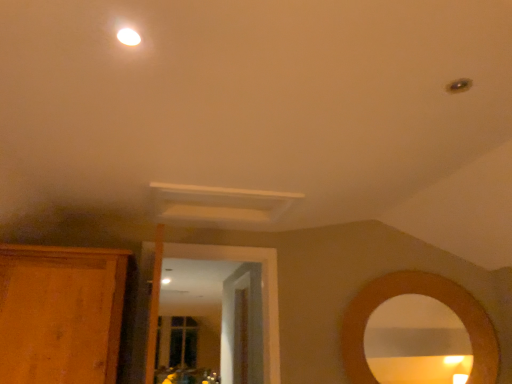
Identify the location of wooden door at center. The height and width of the screenshot is (384, 512). (242, 326).

Find the location of `wooden cabinet at left`. wooden cabinet at left is located at coordinates (61, 314).

Is white glossy light fixture at upper center to the left of wooden cabinet at left from the viewer's perspective?

No.

From the image's perspective, does white glossy light fixture at upper center appear lower than wooden cabinet at left?

No, from the image's perspective, white glossy light fixture at upper center is not below wooden cabinet at left.

In the scene shown: Is wooden door at center aimed at wooden cabinet at left?

No, wooden door at center is not oriented towards wooden cabinet at left.

Looking at this image, from their relative heights in the image, would you say wooden door at center is taller or shorter than wooden cabinet at left?

wooden door at center is taller than wooden cabinet at left.

Is wooden door at center not near wooden cabinet at left?

Yes, wooden door at center and wooden cabinet at left are located far from each other.

You are a GUI agent. You are given a task and a screenshot of the screen. Output one action in this format:
    pyautogui.click(x=<x>, y=<y>)
    Task: Click on the lighting lying on the left of wooden door at center
    Image resolution: width=512 pixels, height=384 pixels.
    Given the screenshot: What is the action you would take?
    pyautogui.click(x=128, y=37)

Looking at this image, who is taller, wooden door at center or white glossy light fixture at upper center?

wooden door at center.

How distant is wooden door at center from white glossy light fixture at upper center?

The distance of wooden door at center from white glossy light fixture at upper center is 3.34 meters.

Is wooden door at center positioned before white glossy light fixture at upper center?

No, wooden door at center is further to the viewer.

Is wooden cabinet at left inside or outside of wooden door at center?

The correct answer is: outside.

Is wooden cabinet at left to the left or to the right of wooden door at center in the image?

Based on their positions, wooden cabinet at left is located to the left of wooden door at center.

In the scene shown: Is wooden cabinet at left wider or thinner than wooden door at center?

In the image, wooden cabinet at left appears to be wider than wooden door at center.

From a real-world perspective, which object rests below the other?

In real-world perspective, wooden door at center is lower.

At what (x,y) coordinates should I click in order to perform the action: click on cabinetry on the left of the white glossy light fixture at upper center. Please return your answer as a coordinate pair (x, y). The image size is (512, 384). Looking at the image, I should click on (61, 314).

How far apart are wooden cabinet at left and white glossy light fixture at upper center?

wooden cabinet at left and white glossy light fixture at upper center are 1.48 meters apart.

From the image's perspective, between wooden cabinet at left and white glossy light fixture at upper center, who is located below?

From the image's view, wooden cabinet at left is below.

Between wooden cabinet at left and white glossy light fixture at upper center, which one has less height?

Standing shorter between the two is white glossy light fixture at upper center.

From the image's perspective, is white glossy light fixture at upper center above or below wooden door at center?

white glossy light fixture at upper center is situated higher than wooden door at center in the image.

Can you tell me how much white glossy light fixture at upper center and wooden door at center differ in facing direction?

They differ by 179 degrees in their facing directions.

From a real-world perspective, relative to wooden door at center, is white glossy light fixture at upper center vertically above or below?

From a real-world perspective, white glossy light fixture at upper center is physically above wooden door at center.

Is white glossy light fixture at upper center shorter than wooden door at center?

Yes, white glossy light fixture at upper center is shorter than wooden door at center.

This screenshot has width=512, height=384. Identify the location of lighting located in front of the wooden cabinet at left. (128, 37).

Identify the location of door behind the wooden cabinet at left. (242, 326).

When comparing their distances from white glossy light fixture at upper center, does wooden door at center or wooden cabinet at left seem closer?

wooden cabinet at left is positioned closer to the anchor white glossy light fixture at upper center.

From the image, which object appears to be farther from wooden door at center, wooden cabinet at left or white glossy light fixture at upper center?

white glossy light fixture at upper center lies further to wooden door at center than the other object.

From the image, which object appears to be nearer to white glossy light fixture at upper center, wooden cabinet at left or wooden door at center?

The object closer to white glossy light fixture at upper center is wooden cabinet at left.

Based on their spatial positions, is white glossy light fixture at upper center or wooden cabinet at left closer to wooden door at center?

wooden cabinet at left lies closer to wooden door at center than the other object.

Based on their spatial positions, is wooden door at center or white glossy light fixture at upper center further from wooden cabinet at left?

The object further to wooden cabinet at left is wooden door at center.

Estimate the real-world distances between objects in this image. Which object is further from wooden cabinet at left, white glossy light fixture at upper center or wooden door at center?

The object further to wooden cabinet at left is wooden door at center.

You are a GUI agent. You are given a task and a screenshot of the screen. Output one action in this format:
    pyautogui.click(x=<x>, y=<y>)
    Task: Click on the cabinetry located between white glossy light fixture at upper center and wooden door at center in the depth direction
    This screenshot has width=512, height=384.
    Given the screenshot: What is the action you would take?
    pyautogui.click(x=61, y=314)